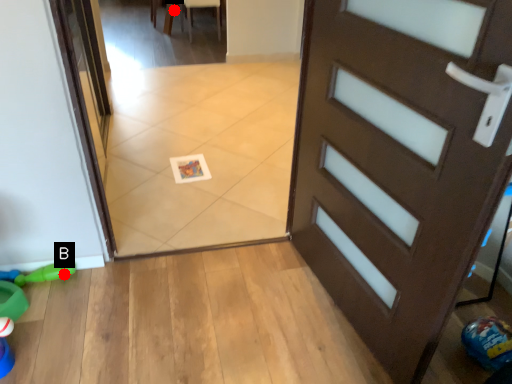
Question: Two points are circled on the image, labeled by A and B beside each circle. Among these points, which one is farthest from the camera?

Choices:
 (A) A is further
 (B) B is further

Answer: (A)